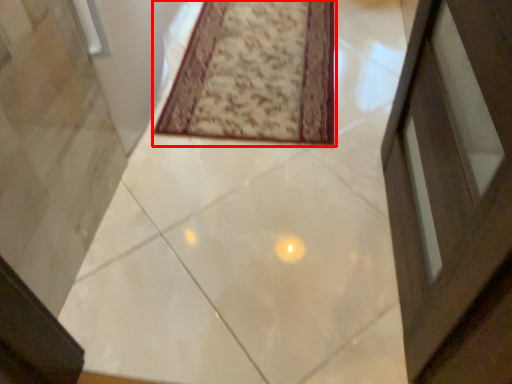
Question: From the image's perspective, where is mat (annotated by the red box) located in relation to concrete in the image?

Choices:
 (A) above
 (B) below

Answer: (A)